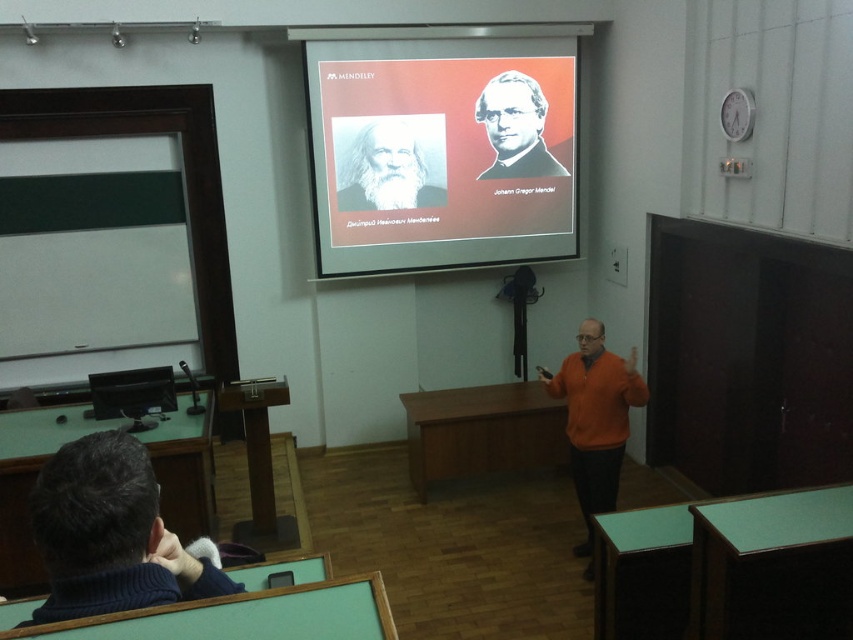
You are a student sitting in the classroom and want to see both the matte plastic projector screen at center and the dark blue sweater at lower left. Which one appears closer to you?

The matte plastic projector screen at center appears closer to you because it is further to the viewer than the dark blue sweater at lower left.

You are a student sitting in the classroom and need to look at both the matte plastic projector screen at center and the white matte portrait at upper center. Which object is located higher in the image?

The matte plastic projector screen at center is above the white matte portrait at upper center, so it is located higher in the image.

You are a student sitting at the desk in the classroom. You notice two points marked on the floor. The first point is at coordinates point (328, 273), and the second point is at point (393, 177). If you want to move from the first point to the second point, which direction should you walk relative to the classroom layout?

Since point (328, 273) is behind point (393, 177), you should walk forward towards the front of the classroom to move from the first point to the second point.